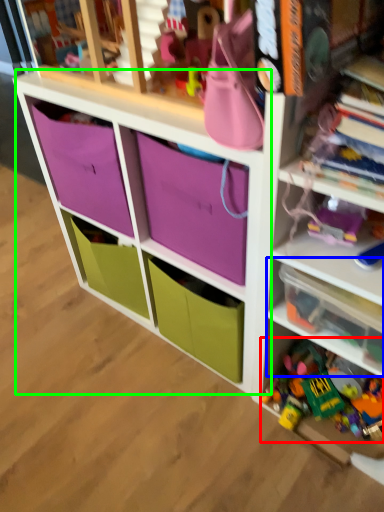
Question: Considering the real-world distances, which object is closest to toy (highlighted by a red box)? shelf (highlighted by a blue box) or cabinet (highlighted by a green box).

Choices:
 (A) shelf
 (B) cabinet

Answer: (A)